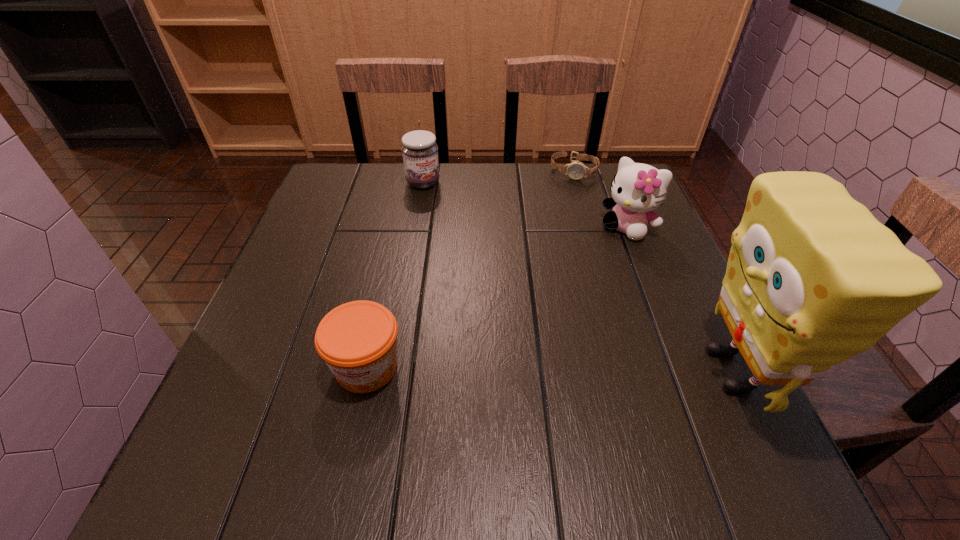
This screenshot has height=540, width=960. I want to click on free space between the tallest object and the shortest object, so click(x=653, y=271).

Find the location of a particular element. Image resolution: width=960 pixels, height=540 pixels. free area in between the shorter jam and the farther jam is located at coordinates (395, 275).

Identify the location of free space between the second shortest object and the taller jam. This screenshot has height=540, width=960. (395, 275).

In order to click on unoccupied position between the taller jam and the second tallest object in this screenshot , I will do `click(525, 205)`.

You are a GUI agent. You are given a task and a screenshot of the screen. Output one action in this format:
    pyautogui.click(x=<x>, y=<y>)
    Task: Click on the unoccupied area between the third nearest object and the tallest object
    The height and width of the screenshot is (540, 960).
    Given the screenshot: What is the action you would take?
    pyautogui.click(x=680, y=299)

The height and width of the screenshot is (540, 960). I want to click on vacant space in between the second shortest object and the watch, so click(470, 269).

The image size is (960, 540). In order to click on object that is the fourth closest one to the third shortest object in this screenshot , I will do `click(813, 278)`.

Identify which object is located as the fourth nearest to the kitten. Please provide its 2D coordinates. Your answer should be formatted as a tuple, i.e. [(x, y)], where the tuple contains the x and y coordinates of a point satisfying the conditions above.

[(358, 340)]

Locate an element on the screen. The height and width of the screenshot is (540, 960). free space that satisfies the following two spatial constraints: 1. on the front side of the taller jam; 2. on the face of the sponge is located at coordinates (391, 370).

The image size is (960, 540). I want to click on vacant region that satisfies the following two spatial constraints: 1. on the front label of the nearer jam; 2. on the face of the sponge, so click(x=366, y=370).